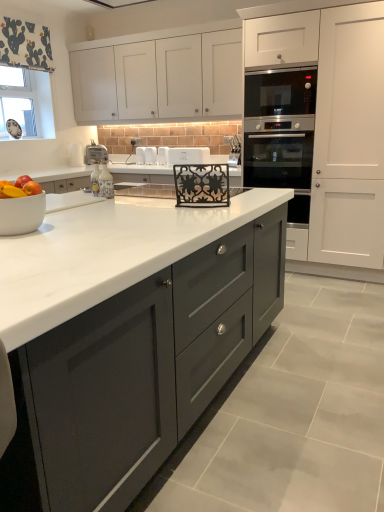
Question: From a real-world perspective, does satin black oven at upper right, marked as the third appliance in a front-to-back arrangement, stand above porcelain bottle at center, the seventh appliance positioned from the back?

Choices:
 (A) no
 (B) yes

Answer: (B)

Question: Is satin black oven at upper right, marked as the third appliance in a front-to-back arrangement, far away from porcelain bottle at center, the second appliance in the front-to-back sequence?

Choices:
 (A) no
 (B) yes

Answer: (B)

Question: From the image's perspective, is satin black oven at upper right, the first appliance positioned from the right, above porcelain bottle at center, the seventh appliance positioned from the back?

Choices:
 (A) no
 (B) yes

Answer: (B)

Question: Is satin black oven at upper right, the 8th appliance viewed from the left, to the right of porcelain bottle at center, marked as the sixth appliance in a right-to-left arrangement, from the viewer's perspective?

Choices:
 (A) yes
 (B) no

Answer: (A)

Question: Is satin black oven at upper right, the first appliance positioned from the right, facing towards porcelain bottle at center, marked as the sixth appliance in a right-to-left arrangement?

Choices:
 (A) no
 (B) yes

Answer: (B)

Question: Is satin black oven at upper right, the 8th appliance viewed from the left, looking in the opposite direction of porcelain bottle at center, marked as the sixth appliance in a right-to-left arrangement?

Choices:
 (A) yes
 (B) no

Answer: (B)

Question: From a real-world perspective, does white matte oven at upper right, marked as the 3th cabinetry in a left-to-right arrangement, stand above white plastic toaster at center, which is the eighth appliance in front-to-back order?

Choices:
 (A) yes
 (B) no

Answer: (A)

Question: Is white matte oven at upper right, marked as the 3th cabinetry in a left-to-right arrangement, turned away from white plastic toaster at center, which appears as the eighth appliance when viewed from the right?

Choices:
 (A) yes
 (B) no

Answer: (B)

Question: Is white matte oven at upper right, marked as the 3th cabinetry in a left-to-right arrangement, further to the viewer compared to white plastic toaster at center, which appears as the eighth appliance when viewed from the right?

Choices:
 (A) no
 (B) yes

Answer: (A)

Question: Is white matte oven at upper right, marked as the 3th cabinetry in a left-to-right arrangement, not near white plastic toaster at center, which appears as the eighth appliance when viewed from the right?

Choices:
 (A) yes
 (B) no

Answer: (A)

Question: Is white matte oven at upper right, marked as the 3th cabinetry in a left-to-right arrangement, smaller than white plastic toaster at center, which is counted as the 1th appliance, starting from the back?

Choices:
 (A) no
 (B) yes

Answer: (A)

Question: Does white matte oven at upper right, marked as the 3th cabinetry in a left-to-right arrangement, lie in front of white plastic toaster at center, which is counted as the 1th appliance, starting from the back?

Choices:
 (A) no
 (B) yes

Answer: (B)

Question: From the image's perspective, is porcelain bottle at center, the third appliance when ordered from left to right, below white plastic toaster at center, which appears as the eighth appliance when viewed from the right?

Choices:
 (A) no
 (B) yes

Answer: (B)